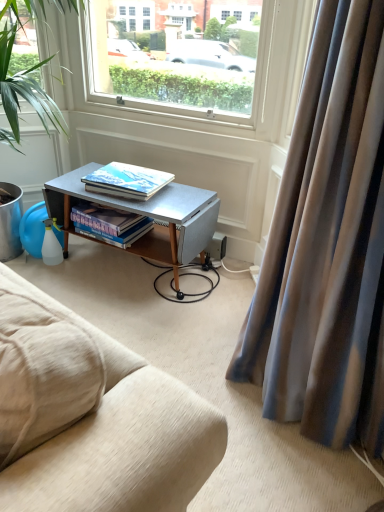
Question: Is green leafy plant at left at the right side of satin fabric curtain at right?

Choices:
 (A) no
 (B) yes

Answer: (A)

Question: Is the depth of green leafy plant at left greater than that of satin fabric curtain at right?

Choices:
 (A) yes
 (B) no

Answer: (A)

Question: Is green leafy plant at left not within satin fabric curtain at right?

Choices:
 (A) yes
 (B) no

Answer: (A)

Question: Is green leafy plant at left taller than satin fabric curtain at right?

Choices:
 (A) no
 (B) yes

Answer: (A)

Question: Is green leafy plant at left oriented away from satin fabric curtain at right?

Choices:
 (A) no
 (B) yes

Answer: (A)

Question: Is green leafy plant at left touching satin fabric curtain at right?

Choices:
 (A) yes
 (B) no

Answer: (B)

Question: Does satin fabric curtain at right have a larger size compared to matte hardcover book at center, placed as the first book when sorted from top to bottom?

Choices:
 (A) yes
 (B) no

Answer: (A)

Question: Is the position of satin fabric curtain at right more distant than that of matte hardcover book at center, the 2th book from the bottom?

Choices:
 (A) no
 (B) yes

Answer: (A)

Question: Is there a large distance between satin fabric curtain at right and matte hardcover book at center, the 2th book from the bottom?

Choices:
 (A) no
 (B) yes

Answer: (A)

Question: Is satin fabric curtain at right at the right side of matte hardcover book at center, the 2th book from the bottom?

Choices:
 (A) no
 (B) yes

Answer: (B)

Question: From a real-world perspective, is satin fabric curtain at right on top of matte hardcover book at center, the 2th book from the bottom?

Choices:
 (A) no
 (B) yes

Answer: (B)

Question: From the image's perspective, would you say satin fabric curtain at right is shown under matte hardcover book at center, placed as the first book when sorted from top to bottom?

Choices:
 (A) yes
 (B) no

Answer: (A)

Question: From a real-world perspective, is satin fabric curtain at right on green leafy plant at left?

Choices:
 (A) no
 (B) yes

Answer: (B)